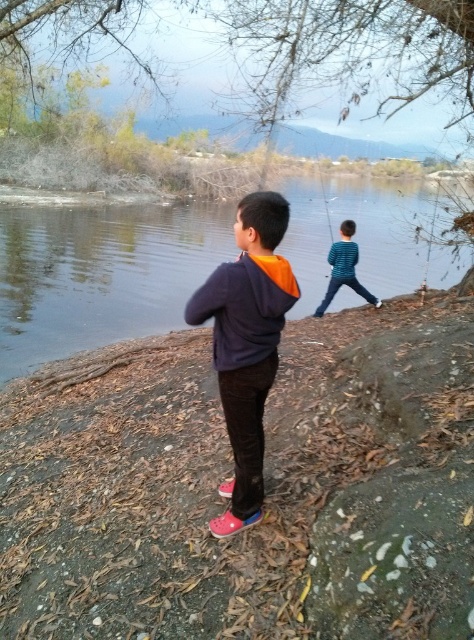
You are a photographer standing at the edge of the water. You want to take a photo that includes both the clear water at center and the blue striped shirt at center. Given that your camera has a maximum focus range of 8 meters, will you be able to capture both subjects in focus without moving?

The clear water at center is 8.82 meters from the blue striped shirt at center. Since the distance between them exceeds the camera maximum focus range of 8 meters, you will not be able to capture both subjects in focus without moving.

You are a photographer trying to capture both children in the scene. Given that the orange fleece hoodie at center is smaller in size compared to the blue striped shirt at center, which child should you focus on to ensure both are fully visible in the frame?

The orange fleece hoodie at center occupies less space than the blue striped shirt at center, so focusing on the child in the blue striped shirt at center would allow both children to be fully visible in the frame since it takes up more space and might be positioned centrally.